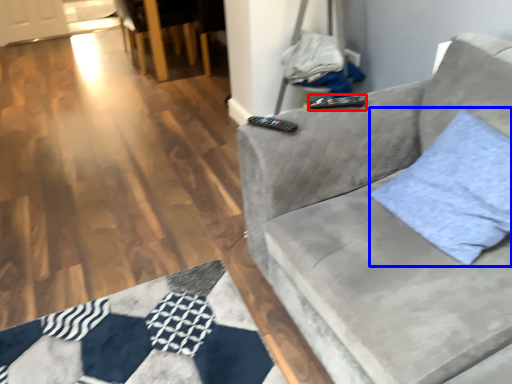
Question: Among these objects, which one is nearest to the camera, remote (highlighted by a red box) or throw pillow (highlighted by a blue box)?

Choices:
 (A) remote
 (B) throw pillow

Answer: (B)